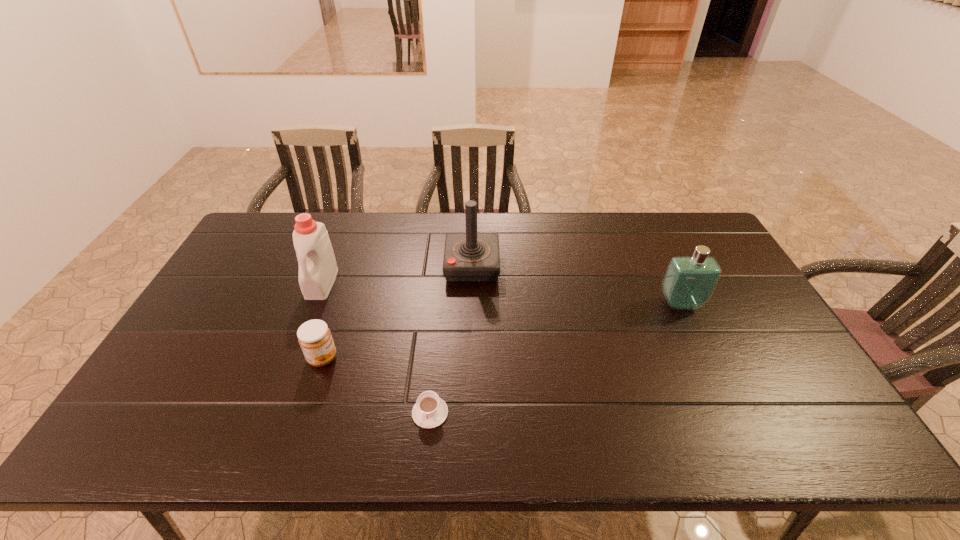
The image size is (960, 540). I want to click on free space between the fourth tallest object and the joystick, so click(397, 312).

The image size is (960, 540). Identify the location of blank region between the joystick and the jam. (397, 312).

I want to click on free space between the teacup and the perfume, so click(x=555, y=358).

Find the location of `empty space that is in between the leftmost object and the fourth tallest object`. empty space that is in between the leftmost object and the fourth tallest object is located at coordinates (322, 321).

Where is `vacant space that's between the shortest object and the leftmost object`? Image resolution: width=960 pixels, height=540 pixels. vacant space that's between the shortest object and the leftmost object is located at coordinates (376, 348).

Find the location of a particular element. free spot between the leftmost object and the shortest object is located at coordinates (376, 348).

You are a GUI agent. You are given a task and a screenshot of the screen. Output one action in this format:
    pyautogui.click(x=<x>, y=<y>)
    Task: Click on the free space between the third tallest object and the teacup
    This screenshot has height=540, width=960.
    Given the screenshot: What is the action you would take?
    pyautogui.click(x=555, y=358)

The width and height of the screenshot is (960, 540). What are the coordinates of `vacant area that lies between the joystick and the nearest object` in the screenshot? It's located at (451, 339).

Identify the location of vacant space that's between the joystick and the second shortest object. (397, 312).

Locate an element on the screen. The image size is (960, 540). blank region between the leftmost object and the teacup is located at coordinates (376, 348).